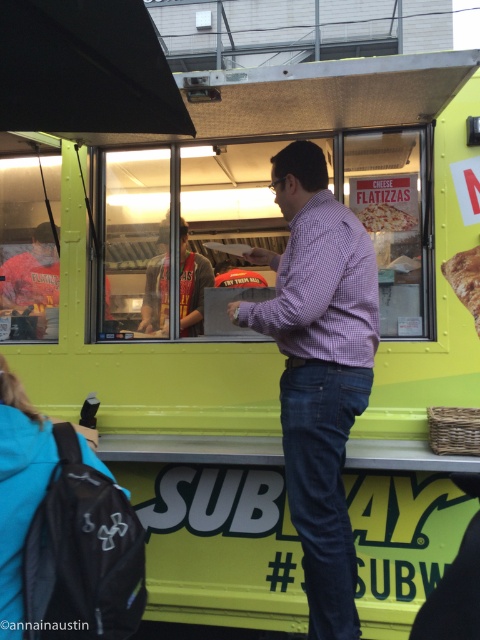
Question: Which point is farther to the camera?

Choices:
 (A) purple checkered shirt at center
 (B) gray fabric shirt at center
 (C) cheese pizza at center
 (D) black backpack at lower left

Answer: (B)

Question: Is purple checkered shirt at center closer to camera compared to gray fabric shirt at center?

Choices:
 (A) yes
 (B) no

Answer: (A)

Question: Which is nearer to the golden brown bread at right?

Choices:
 (A) cheese pizza at center
 (B) purple checkered shirt at center
 (C) gray fabric shirt at center

Answer: (A)

Question: Which of the following is the closest to the observer?

Choices:
 (A) black backpack at lower left
 (B) cheese pizza at center

Answer: (A)

Question: Does black backpack at lower left lie in front of gray fabric shirt at center?

Choices:
 (A) yes
 (B) no

Answer: (A)

Question: Does black backpack at lower left have a smaller size compared to gray fabric shirt at center?

Choices:
 (A) no
 (B) yes

Answer: (B)